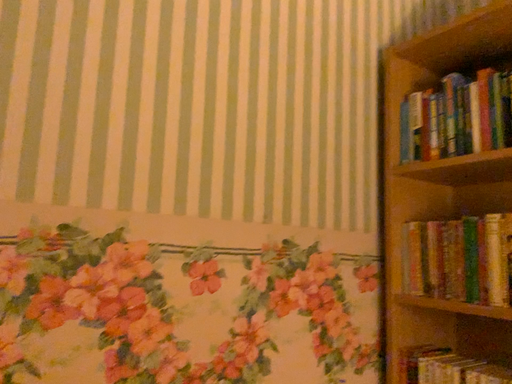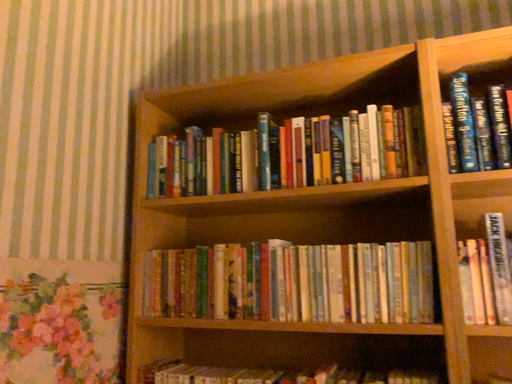
Question: How did the camera likely rotate when shooting the video?

Choices:
 (A) rotated left
 (B) rotated right

Answer: (B)